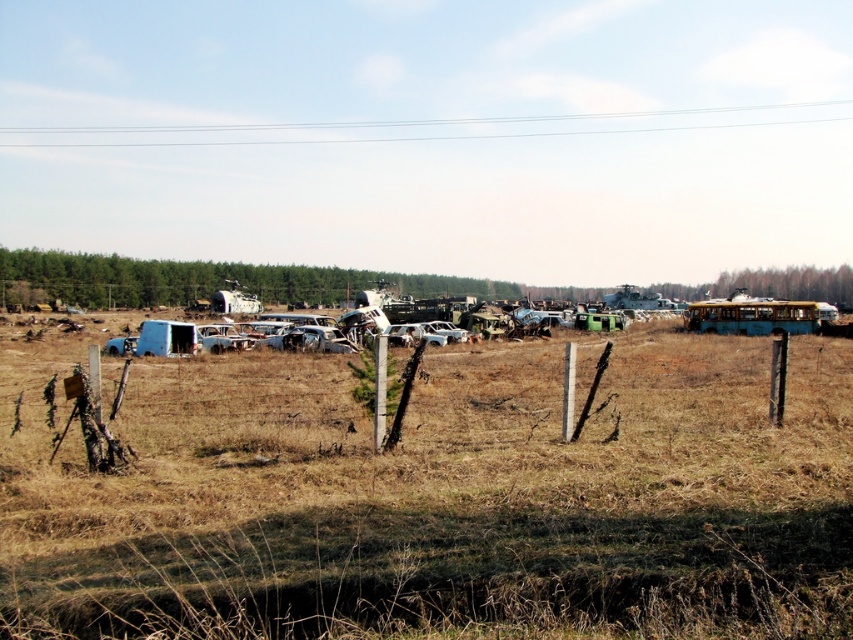
You are a photographer wanting to capture the blue matte bus at right and the silver metallic car at center in a single frame. Based on their positions, which vehicle should you focus on first to ensure both are in the shot?

The silver metallic car at center is behind the blue matte bus at right, so you should focus on the blue matte bus at right first to ensure both are in the shot.

You are standing in the middle of a junkyard and see the brown dry grass at center and the silver metallic car at center. Which object is closer to the ground?

The brown dry grass at center is located below the silver metallic car at center, so it is closer to the ground.